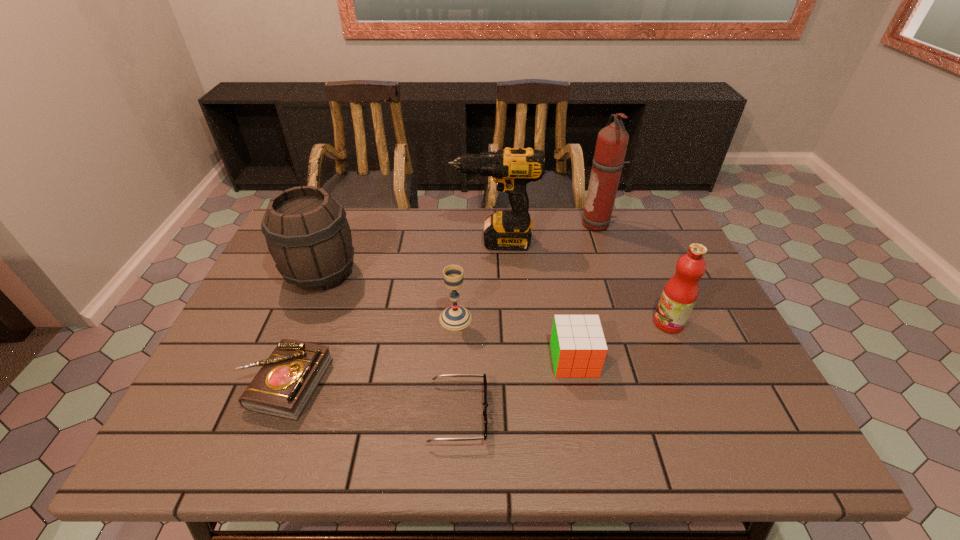
You are a GUI agent. You are given a task and a screenshot of the screen. Output one action in this format:
    pyautogui.click(x=<x>, y=<y>)
    Task: Click on the free spot that satisfies the following two spatial constraints: 1. at the tip of the drill; 2. on the back side of the third shortest object
    The height and width of the screenshot is (540, 960).
    Given the screenshot: What is the action you would take?
    pyautogui.click(x=499, y=360)